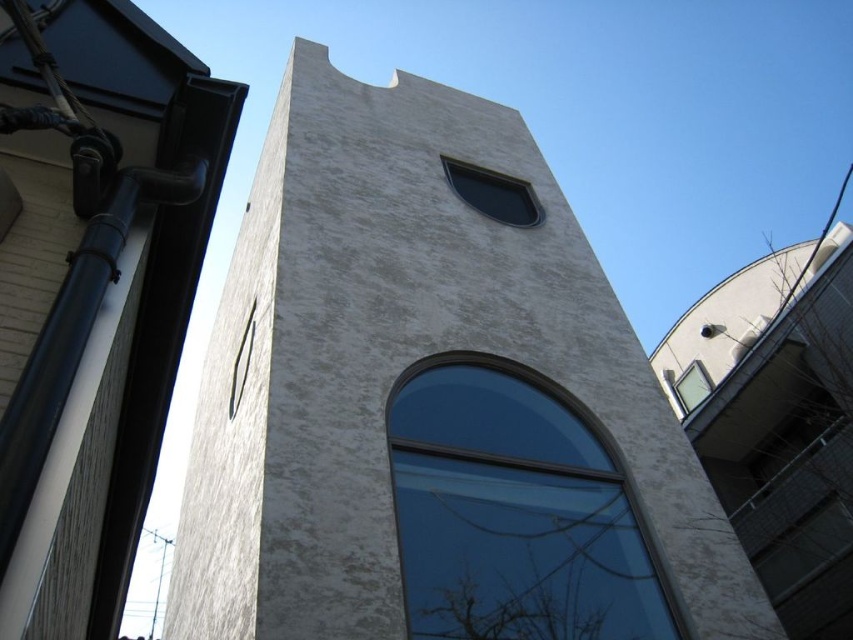
You are an architect analyzing the building layout. You notice two windows, the transparent glass window at upper center and the clear glass window at upper right. Which window is positioned higher in the structure?

The transparent glass window at upper center is positioned higher in the structure as it is above the clear glass window at upper right.

You are an architect analyzing the building facade. You notice the transparent glass window at upper center and the metallic silver clock at upper left. Which object is taller?

The metallic silver clock at upper left is taller than the transparent glass window at upper center.

You are an architect assessing the building facade. You notice the transparent glass window at upper center and the clear glass window at upper right. Which of these two windows has a greater width?

The transparent glass window at upper center has a greater width than the clear glass window at upper right.